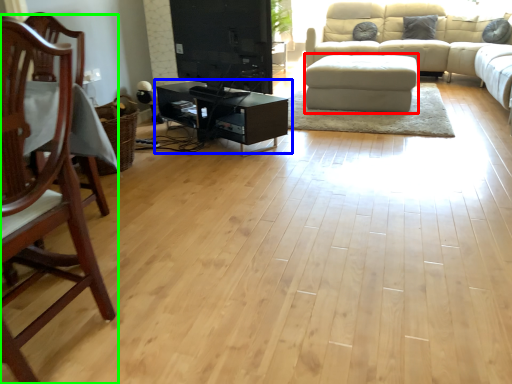
Question: Estimate the real-world distances between objects in this image. Which object is closer to footrest (highlighted by a red box), table (highlighted by a blue box) or chair (highlighted by a green box)?

Choices:
 (A) table
 (B) chair

Answer: (A)